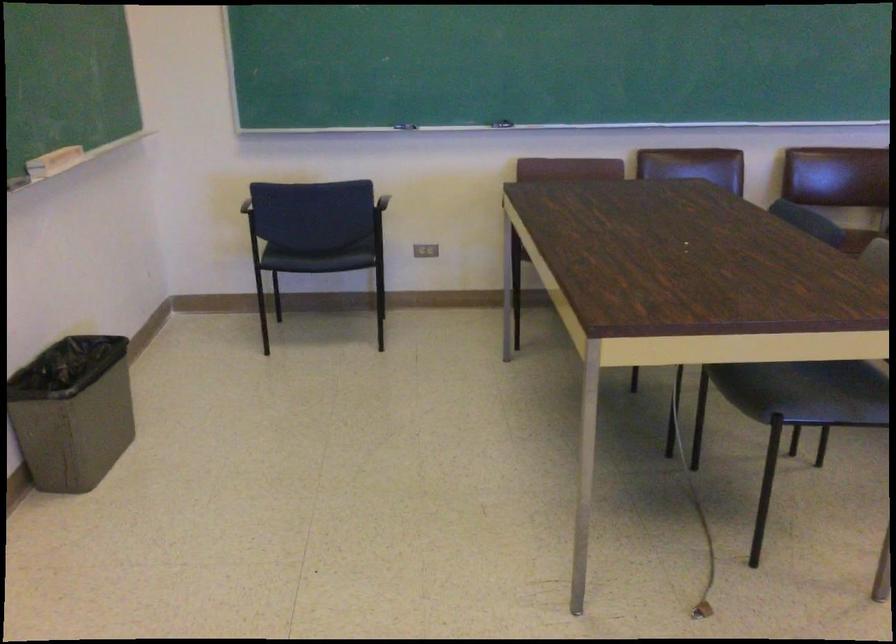
Describe the element at coordinates (73, 412) in the screenshot. Image resolution: width=896 pixels, height=644 pixels. I see `the grey trash can` at that location.